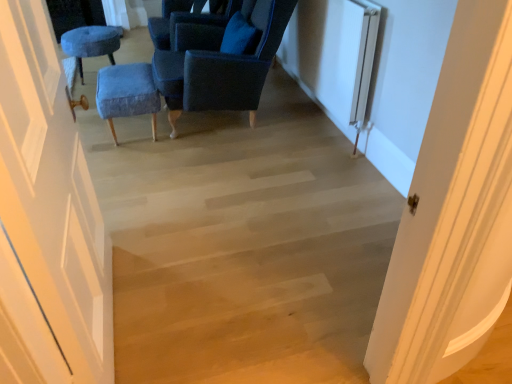
Question: Is white matte door at left facing away from velvet blue ottoman at center, which appears as the 1th furniture when ordered from the bottom?

Choices:
 (A) yes
 (B) no

Answer: (B)

Question: Can velvet blue ottoman at center, positioned as the first furniture in front-to-back order, be found inside white matte door at left?

Choices:
 (A) no
 (B) yes

Answer: (A)

Question: Would you say white matte door at left is a long distance from velvet blue ottoman at center, which appears as the first furniture when viewed from the right?

Choices:
 (A) no
 (B) yes

Answer: (B)

Question: From a real-world perspective, is white matte door at left on velvet blue ottoman at center, which appears as the first furniture when viewed from the right?

Choices:
 (A) yes
 (B) no

Answer: (A)

Question: From the image's perspective, is white matte door at left on top of velvet blue ottoman at center, which appears as the 1th furniture when ordered from the bottom?

Choices:
 (A) yes
 (B) no

Answer: (B)

Question: Does white matte door at left appear on the left side of velvet blue ottoman at center, positioned as the first furniture in front-to-back order?

Choices:
 (A) no
 (B) yes

Answer: (A)

Question: Is velvet blue chair at upper center, the 1th chair viewed from the back, oriented away from velvet blue chair at center, arranged as the 1th chair when viewed from the front?

Choices:
 (A) yes
 (B) no

Answer: (B)

Question: Does velvet blue chair at upper center, the second chair viewed from the front, come in front of velvet blue chair at center, placed as the second chair when sorted from back to front?

Choices:
 (A) no
 (B) yes

Answer: (A)

Question: Is velvet blue chair at center, arranged as the 1th chair when viewed from the front, surrounded by velvet blue chair at upper center, the second chair viewed from the front?

Choices:
 (A) no
 (B) yes

Answer: (A)

Question: Considering the relative sizes of velvet blue chair at upper center, the second chair viewed from the front, and velvet blue chair at center, placed as the second chair when sorted from back to front, in the image provided, is velvet blue chair at upper center, the second chair viewed from the front, bigger than velvet blue chair at center, placed as the second chair when sorted from back to front,?

Choices:
 (A) no
 (B) yes

Answer: (A)

Question: Is velvet blue chair at upper center, the second chair viewed from the front, smaller than velvet blue chair at center, placed as the second chair when sorted from back to front?

Choices:
 (A) yes
 (B) no

Answer: (A)

Question: Considering the relative positions of velvet blue chair at upper center, the second chair viewed from the front, and velvet blue chair at center, placed as the second chair when sorted from back to front, in the image provided, is velvet blue chair at upper center, the second chair viewed from the front, to the right of velvet blue chair at center, placed as the second chair when sorted from back to front, from the viewer's perspective?

Choices:
 (A) no
 (B) yes

Answer: (A)

Question: Is velvet blue ottoman at center, which appears as the first furniture when viewed from the right, at the right side of velvet blue chair at center, arranged as the 1th chair when viewed from the front?

Choices:
 (A) no
 (B) yes

Answer: (A)